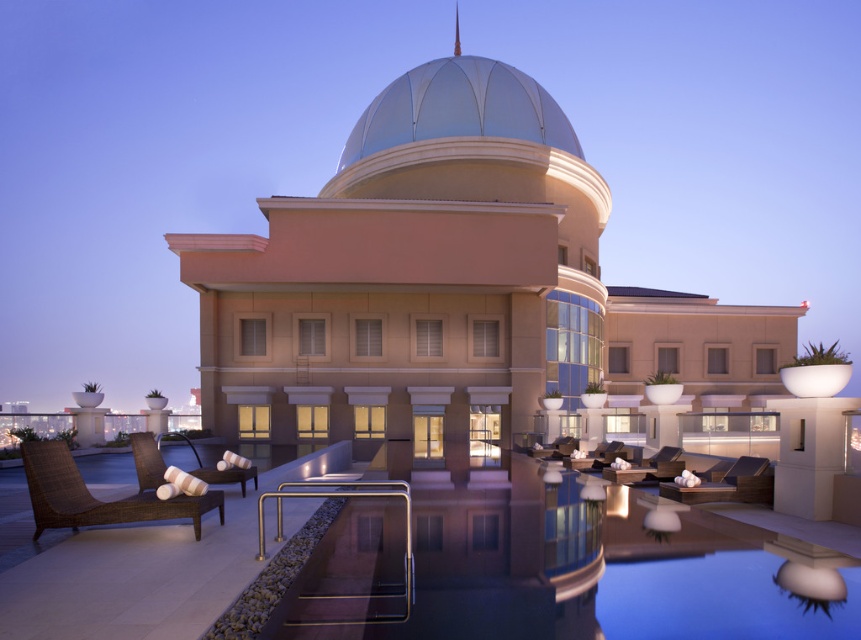
Who is shorter, dark brown wooden chair at lower right or brown woven chair at center?

Standing shorter between the two is dark brown wooden chair at lower right.

Is point (717, 483) positioned behind point (547, 456)?

No.

This screenshot has height=640, width=861. What are the coordinates of `dark brown wooden chair at lower right` in the screenshot? It's located at (728, 484).

Who is positioned more to the right, brown wicker chaise lounge at lower left or white textured lounge chair at lower left?

brown wicker chaise lounge at lower left is more to the right.

Locate an element on the screen. brown wicker chaise lounge at lower left is located at coordinates (93, 497).

Based on the photo, can you confirm if white textured lounge chair at lower left is wider than dark brown wicker lounge chair at center?

Incorrect, white textured lounge chair at lower left's width does not surpass dark brown wicker lounge chair at center's.

The height and width of the screenshot is (640, 861). Describe the element at coordinates (146, 460) in the screenshot. I see `white textured lounge chair at lower left` at that location.

The image size is (861, 640). I want to click on white textured lounge chair at lower left, so click(146, 460).

What are the coordinates of `white textured lounge chair at lower left` in the screenshot? It's located at (146, 460).